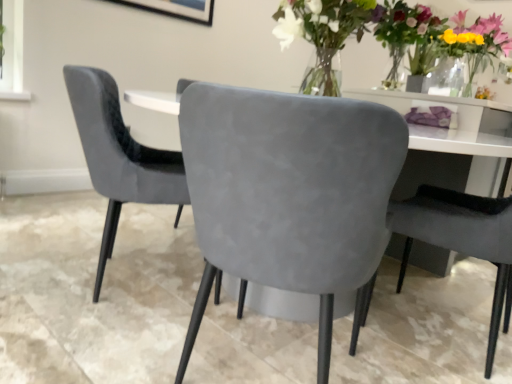
Find the location of `free space to the back side of suede gray chair at center, which ranks as the first chair in right-to-left order`. free space to the back side of suede gray chair at center, which ranks as the first chair in right-to-left order is located at coordinates (431, 285).